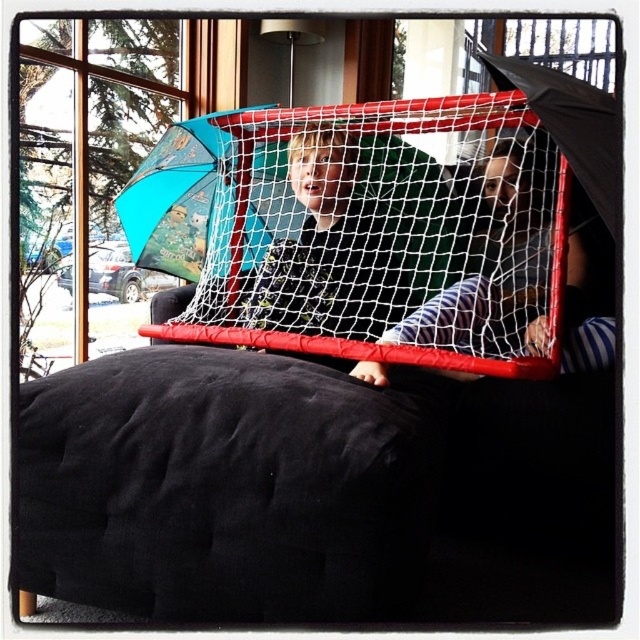
Question: Does striped fabric shirt at center have a larger size compared to matte black shirt at center?

Choices:
 (A) yes
 (B) no

Answer: (A)

Question: Which point is closer to the camera?

Choices:
 (A) striped fabric shirt at center
 (B) blue fabric umbrella at upper left

Answer: (A)

Question: Considering the real-world distances, which object is farthest from the striped fabric shirt at center?

Choices:
 (A) blue fabric umbrella at upper left
 (B) matte black shirt at center

Answer: (A)

Question: Is blue fabric umbrella at upper left below matte black shirt at center?

Choices:
 (A) no
 (B) yes

Answer: (A)

Question: Can you confirm if striped fabric shirt at center is smaller than blue fabric umbrella at upper left?

Choices:
 (A) yes
 (B) no

Answer: (A)

Question: Which point is closer to the camera?

Choices:
 (A) striped fabric shirt at center
 (B) blue fabric umbrella at upper left

Answer: (A)